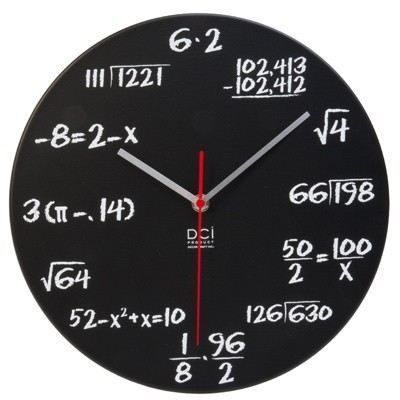
Locate an element on the screen. clockface is located at coordinates (120, 262), (242, 268), (220, 149).